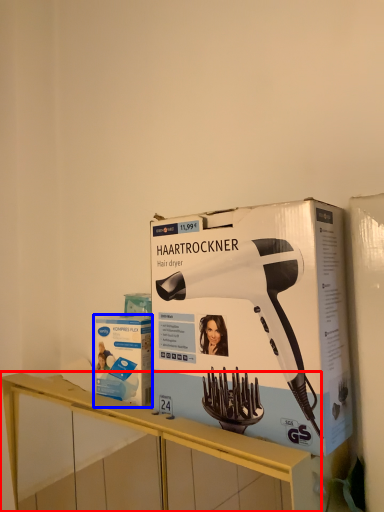
Question: Which object is closer to the camera taking this photo, furniture (highlighted by a red box) or box (highlighted by a blue box)?

Choices:
 (A) furniture
 (B) box

Answer: (A)